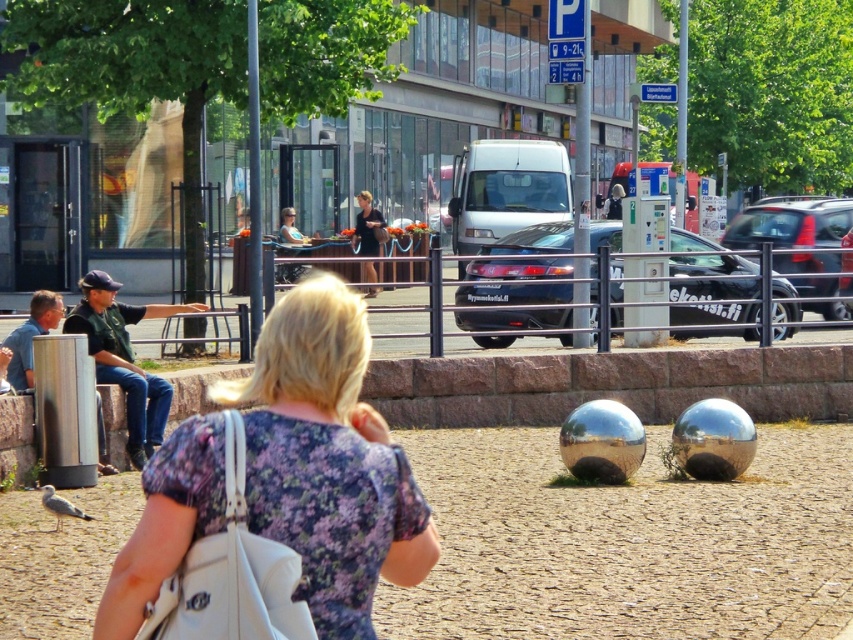
Question: Which point is closer to the camera?

Choices:
 (A) (482, 262)
 (B) (340, 317)
 (C) (839, 211)

Answer: (B)

Question: Among these points, which one is farthest from the camera?

Choices:
 (A) (813, 282)
 (B) (70, 321)
 (C) (366, 218)

Answer: (C)

Question: Which point appears farthest from the camera in this image?

Choices:
 (A) (363, 228)
 (B) (734, 236)

Answer: (A)

Question: Is metallic silver car at center closer to camera compared to dark blue shirt at center?

Choices:
 (A) no
 (B) yes

Answer: (B)

Question: Can you confirm if floral fabric dress at center is thinner than metallic silver car at center?

Choices:
 (A) yes
 (B) no

Answer: (A)

Question: Is black glossy car at center wider than jeans at left?

Choices:
 (A) no
 (B) yes

Answer: (B)